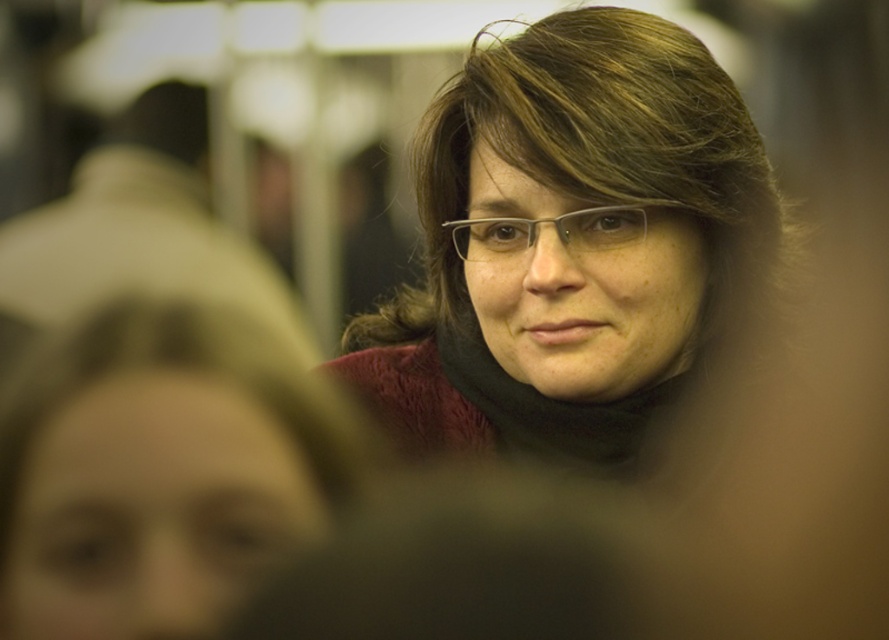
You are a photographer trying to adjust the lighting on the person in the image. The point at point (574,250) is part of the matte black scarf at center. Where should you position your light source to best highlight the texture of the scarf?

To highlight the texture of the matte black scarf at center represented by point (574,250), position the light source at an angle to the scarf. This creates shadows that emphasize its texture without causing harsh reflections.

You are taking a photo of the person in the scene. You want to focus on the point at the top left corner of the image. Which point, point at (618, 49) or point at (37, 620), is closer to the camera and thus more in focus?

Point at (618, 49) is further to the camera than point at (37, 620), so the point at (618, 49) is more in focus.

You are a photographer adjusting the camera settings to focus on both the matte black scarf at upper center and the clear plastic glasses at center. Since the camera can only focus on one object at a time, which object should you prioritize focusing on if you want the wider object to be in sharp detail?

The matte black scarf at upper center has a greater width than the clear plastic glasses at center, so you should prioritize focusing on the matte black scarf at upper center to ensure its wider dimensions are in sharp detail.